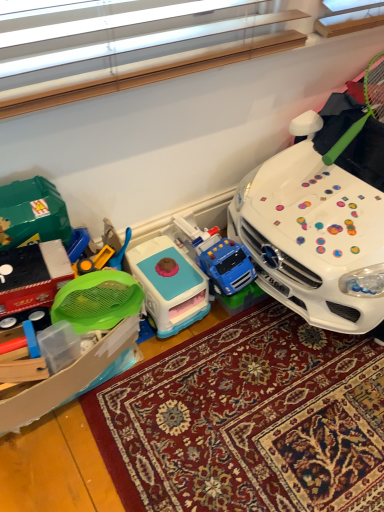
Where is `vacant area that is in front of blue plastic play kitchen at center, arranged as the 2th toy when viewed from the left`? vacant area that is in front of blue plastic play kitchen at center, arranged as the 2th toy when viewed from the left is located at coordinates (163, 371).